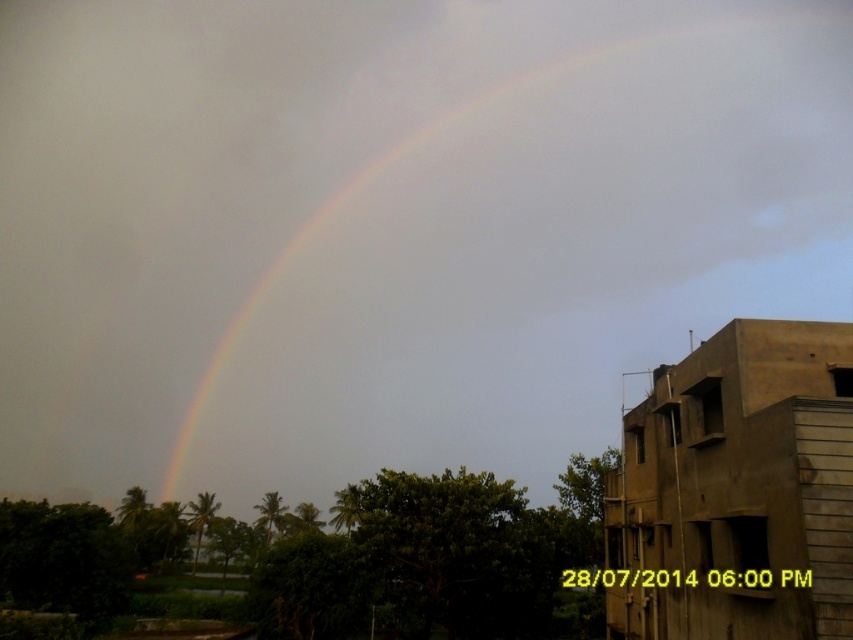
Can you confirm if rainbow at center is positioned above brown concrete building at right?

Yes, rainbow at center is above brown concrete building at right.

Is point (318, 436) positioned in front of point (682, 465)?

No, (318, 436) is further to viewer.

The height and width of the screenshot is (640, 853). Find the location of `rainbow at center`. rainbow at center is located at coordinates (521, 236).